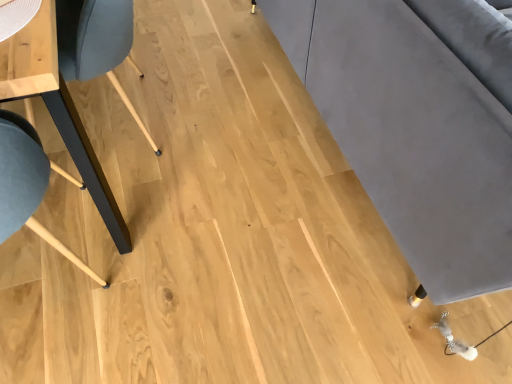
This screenshot has width=512, height=384. Identify the location of vacant space to the right of matte wood table at left. (240, 188).